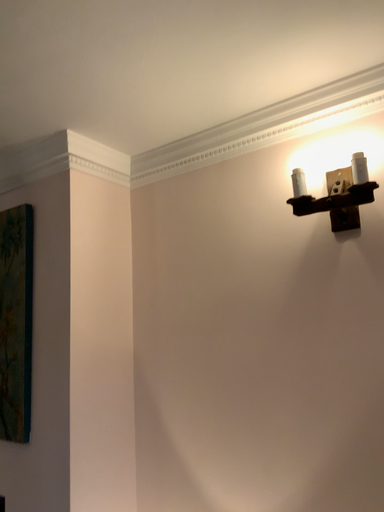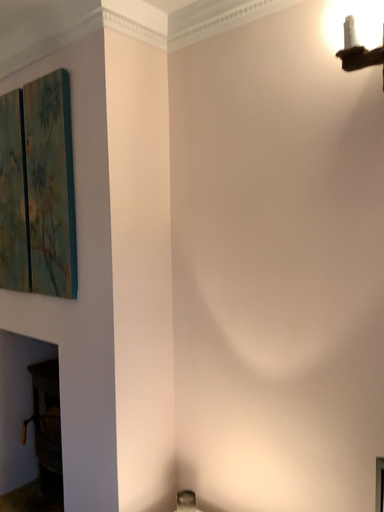
Question: How did the camera likely rotate when shooting the video?

Choices:
 (A) rotated upward
 (B) rotated downward

Answer: (B)